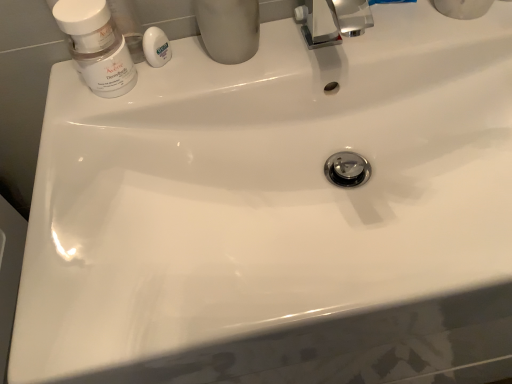
The image size is (512, 384). What are the coordinates of `vacant space to the left of matte white jar at upper left` in the screenshot? It's located at (66, 97).